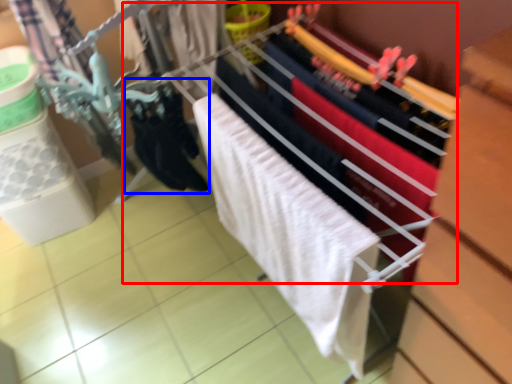
Question: Which object appears closest to the camera in this image, closet (highlighted by a red box) or clothing (highlighted by a blue box)?

Choices:
 (A) closet
 (B) clothing

Answer: (A)